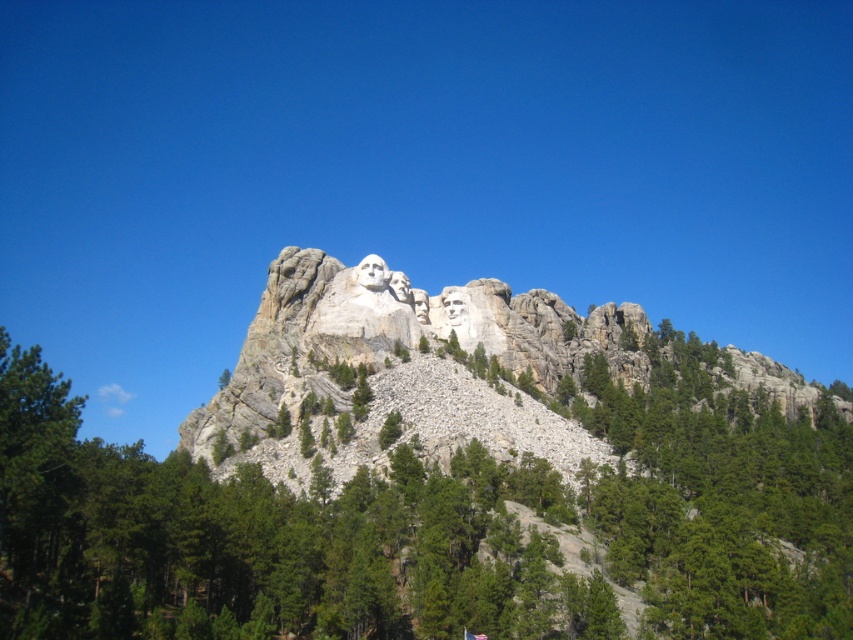
Question: Can you confirm if green leafy tree at center is thinner than white stone mountain at center?

Choices:
 (A) yes
 (B) no

Answer: (A)

Question: Can you confirm if green leafy tree at center is positioned above white stone mountain at center?

Choices:
 (A) yes
 (B) no

Answer: (B)

Question: Which of the following is the farthest from the observer?

Choices:
 (A) (792, 403)
 (B) (73, 401)

Answer: (A)

Question: Which point is farther to the camera?

Choices:
 (A) (396, 532)
 (B) (180, 445)

Answer: (B)

Question: Is green leafy tree at center positioned before white stone mountain at center?

Choices:
 (A) yes
 (B) no

Answer: (A)